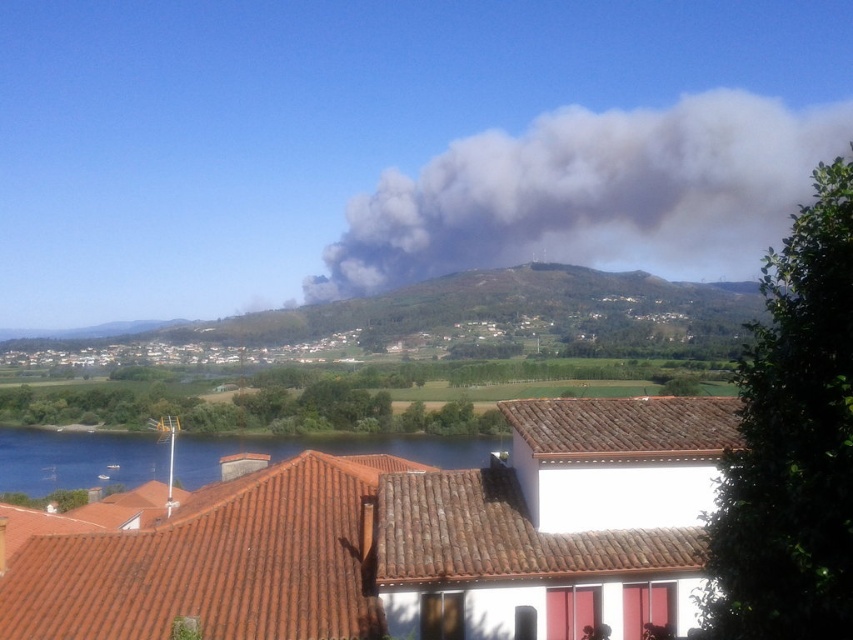
Question: Which of the following is the farthest from the observer?

Choices:
 (A) click(x=419, y=436)
 (B) click(x=784, y=115)

Answer: (B)

Question: Is gray smoke at upper center closer to camera compared to blue water at lower left?

Choices:
 (A) no
 (B) yes

Answer: (A)

Question: Does gray smoke at upper center appear on the left side of blue water at lower left?

Choices:
 (A) yes
 (B) no

Answer: (B)

Question: Which point is closer to the camera?

Choices:
 (A) blue water at lower left
 (B) gray smoke at upper center

Answer: (A)

Question: Among these objects, which one is farthest from the camera?

Choices:
 (A) gray smoke at upper center
 (B) blue water at lower left

Answer: (A)

Question: Is gray smoke at upper center to the right of blue water at lower left from the viewer's perspective?

Choices:
 (A) yes
 (B) no

Answer: (A)